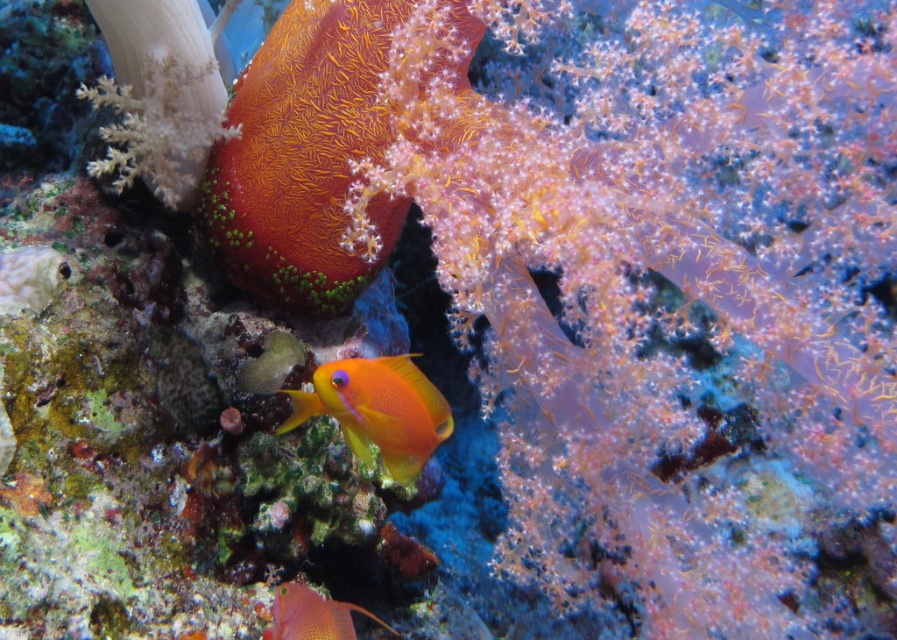
Does orange matte fish at center have a smaller size compared to orange glossy fish at center?

Yes.

Between orange matte fish at center and orange glossy fish at center, which one is positioned higher?

orange matte fish at center is higher up.

Where is `orange matte fish at center`? The width and height of the screenshot is (897, 640). orange matte fish at center is located at coordinates (377, 410).

Find the location of a particular element. This screenshot has width=897, height=640. orange matte fish at center is located at coordinates pos(377,410).